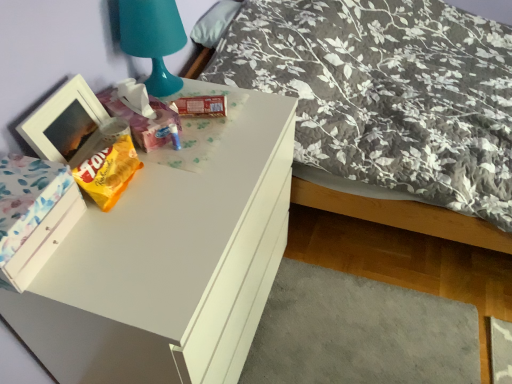
Find the location of a particular element. The image size is (512, 384). spots to the right of white painted wood drawer at lower left is located at coordinates (114, 249).